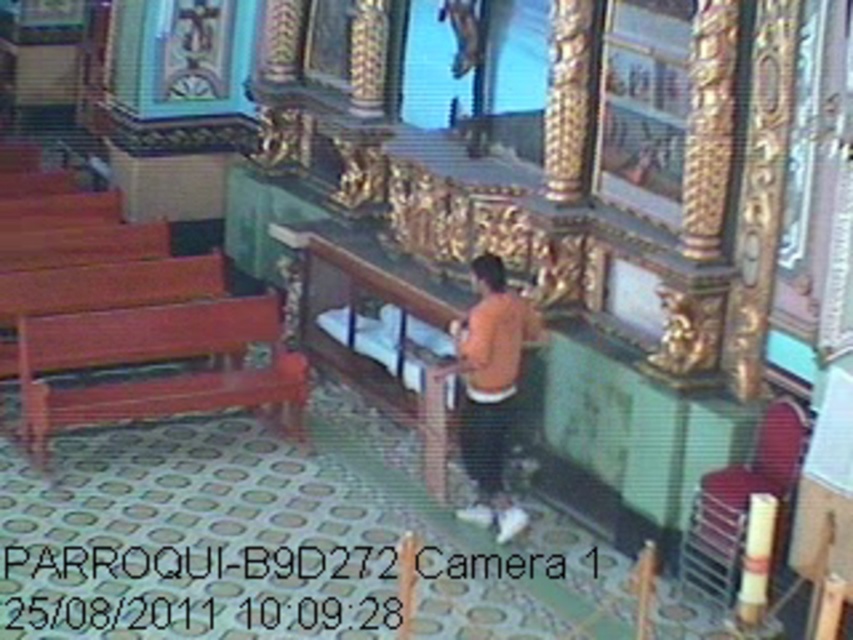
Question: Which point is farther from the camera taking this photo?

Choices:
 (A) (482, 316)
 (B) (112, 336)

Answer: (B)

Question: Is wooden polished bench at left below orange matte shirt at center?

Choices:
 (A) no
 (B) yes

Answer: (A)

Question: Can you confirm if wooden polished bench at left is positioned above orange matte shirt at center?

Choices:
 (A) yes
 (B) no

Answer: (A)

Question: Can you confirm if wooden polished bench at left is smaller than orange matte shirt at center?

Choices:
 (A) yes
 (B) no

Answer: (B)

Question: Which point appears closest to the camera in this image?

Choices:
 (A) (474, 388)
 (B) (32, 380)

Answer: (A)